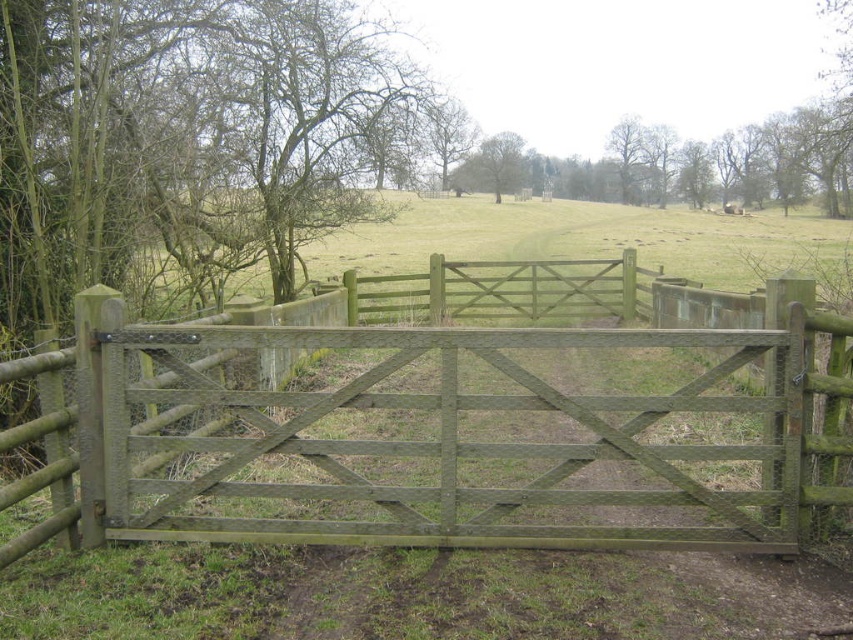
Question: Which of these objects is positioned farthest from the smooth brown tree at center?

Choices:
 (A) smooth brown tree at upper center
 (B) green wood gate at center

Answer: (B)

Question: Which of these objects is positioned farthest from the smooth brown tree at center?

Choices:
 (A) smooth brown tree at upper center
 (B) green wood gate at center

Answer: (B)

Question: Does smooth brown tree at upper center appear over smooth brown tree at center?

Choices:
 (A) yes
 (B) no

Answer: (B)

Question: Does green wood gate at center come in front of smooth brown tree at center?

Choices:
 (A) no
 (B) yes

Answer: (B)

Question: Is green wood gate at center to the left of smooth brown tree at upper center from the viewer's perspective?

Choices:
 (A) yes
 (B) no

Answer: (B)

Question: Which of the following is the farthest from the observer?

Choices:
 (A) smooth brown tree at upper center
 (B) smooth brown tree at center
 (C) green wood gate at center

Answer: (B)